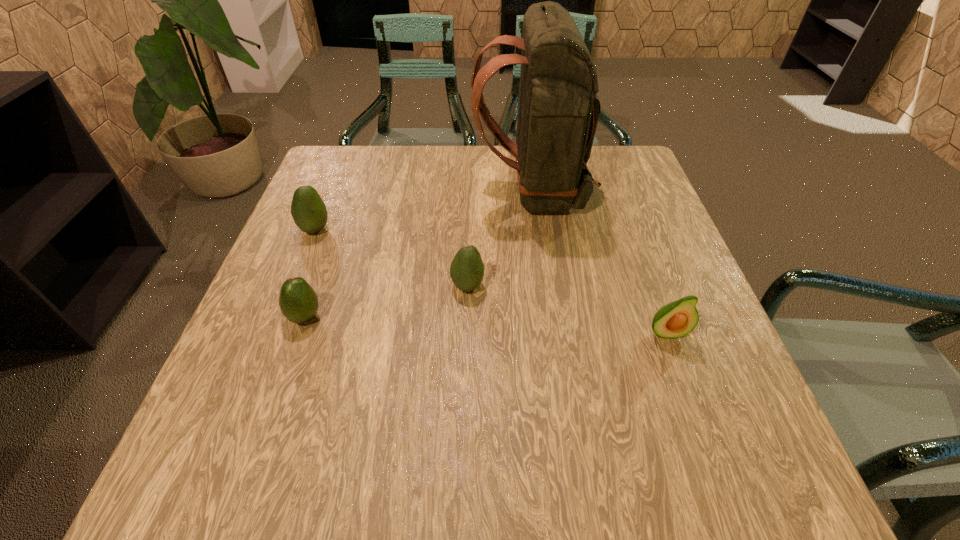
This screenshot has width=960, height=540. In the image, there is a desktop. Identify the location of vacant space at the far right corner. (589, 163).

Where is `free location at the near right corner`? The image size is (960, 540). free location at the near right corner is located at coordinates (760, 476).

Find the location of a particular element. This screenshot has height=540, width=960. empty space that is in between the farthest avocado and the rightmost avocado is located at coordinates (491, 281).

Image resolution: width=960 pixels, height=540 pixels. I want to click on blank region between the farthest avocado and the tallest object, so (423, 210).

This screenshot has width=960, height=540. I want to click on vacant area between the third nearest object and the rightmost object, so click(566, 309).

Find the location of `free spot between the farthest avocado and the tallest object`. free spot between the farthest avocado and the tallest object is located at coordinates (423, 210).

Where is `unoccupied position between the rightmost avocado and the tallest object`? The width and height of the screenshot is (960, 540). unoccupied position between the rightmost avocado and the tallest object is located at coordinates (599, 262).

The height and width of the screenshot is (540, 960). I want to click on vacant space in between the rightmost object and the farthest avocado, so pyautogui.click(x=491, y=281).

Where is `free space between the third avocado from left to right and the rightmost object`? The image size is (960, 540). free space between the third avocado from left to right and the rightmost object is located at coordinates (566, 309).

I want to click on empty space between the backpack and the rightmost object, so 599,262.